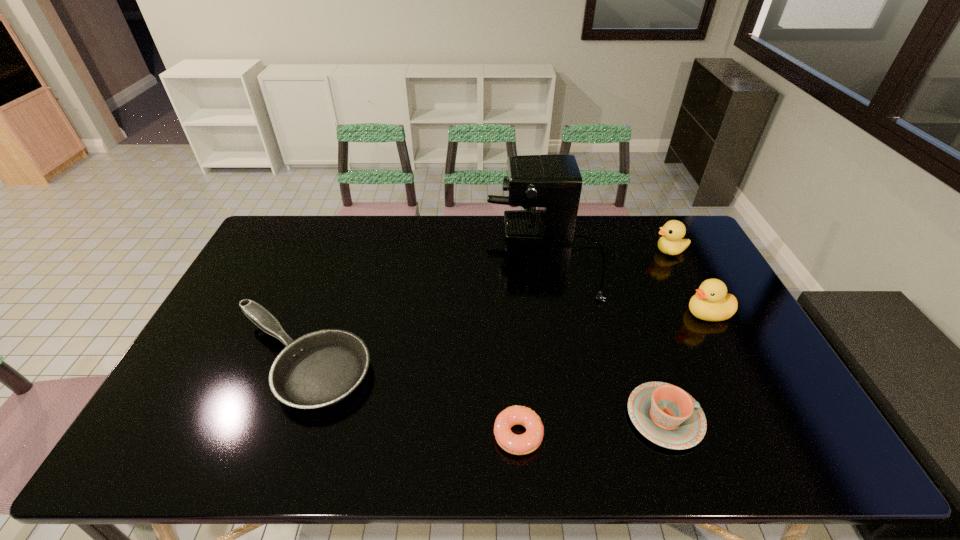
What are the coordinates of `chinaware located in the near edge section of the desktop` in the screenshot? It's located at pyautogui.click(x=668, y=416).

This screenshot has width=960, height=540. I want to click on doughnut positioned at the near edge, so click(x=525, y=443).

Identify the location of object present at the left edge. (317, 370).

The height and width of the screenshot is (540, 960). I want to click on object at the far right corner, so click(671, 243).

This screenshot has height=540, width=960. Identify the location of free space at the far edge of the desktop. (382, 217).

Identify the location of vacant space at the near edge of the desktop. (632, 437).

This screenshot has width=960, height=540. Identify the location of vacant region at the right edge of the desktop. (763, 399).

You are a GUI agent. You are given a task and a screenshot of the screen. Output one action in this format:
    pyautogui.click(x=<x>, y=<y>)
    Task: Click on the free region at the far right corner
    This screenshot has height=540, width=960.
    Given the screenshot: What is the action you would take?
    pyautogui.click(x=650, y=226)

You are a GUI agent. You are given a task and a screenshot of the screen. Output one action in this format:
    pyautogui.click(x=<x>, y=<y>)
    Task: Click on the vacant space that's between the leftmost object and the coffee maker
    This screenshot has width=960, height=540.
    Given the screenshot: What is the action you would take?
    pyautogui.click(x=422, y=308)

Identify the location of free space between the doughnut and the farther duck. (594, 343).